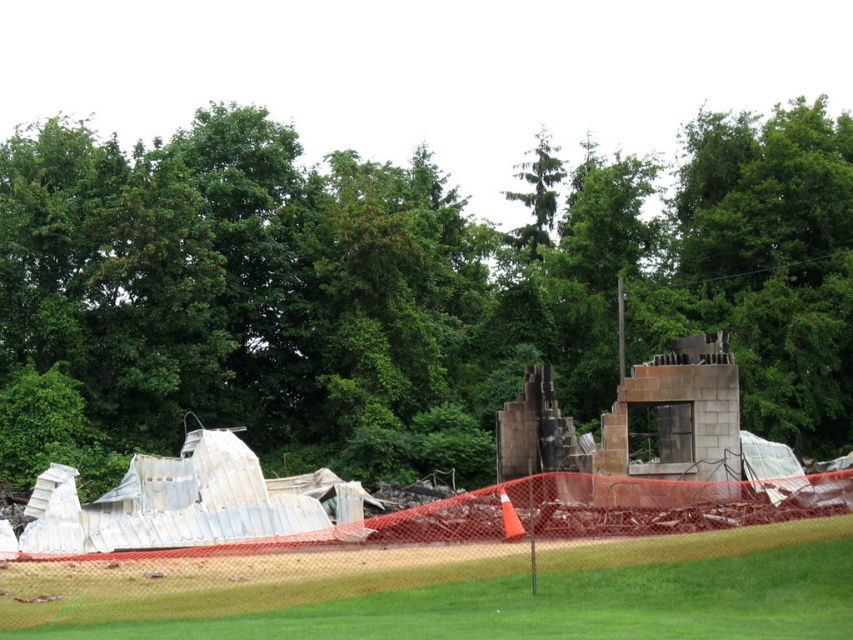
Does green leafy tree at upper center appear on the right side of green grass at lower center?

Incorrect, green leafy tree at upper center is not on the right side of green grass at lower center.

From the picture: Which of these two, green leafy tree at upper center or green grass at lower center, stands shorter?

With less height is green grass at lower center.

Is point (809, 340) closer to viewer compared to point (216, 602)?

No, (809, 340) is behind (216, 602).

Locate an element on the screen. Image resolution: width=853 pixels, height=640 pixels. green leafy tree at upper center is located at coordinates (399, 292).